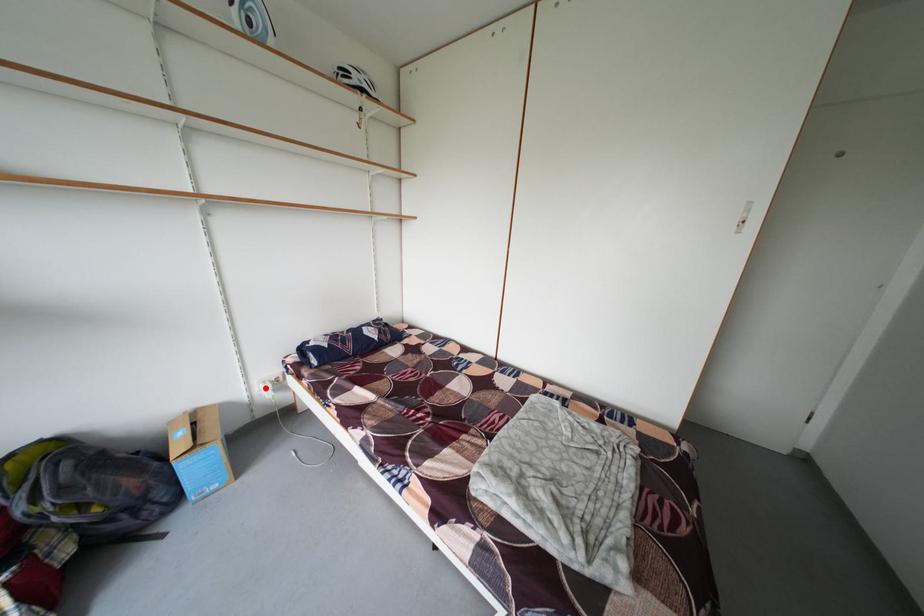
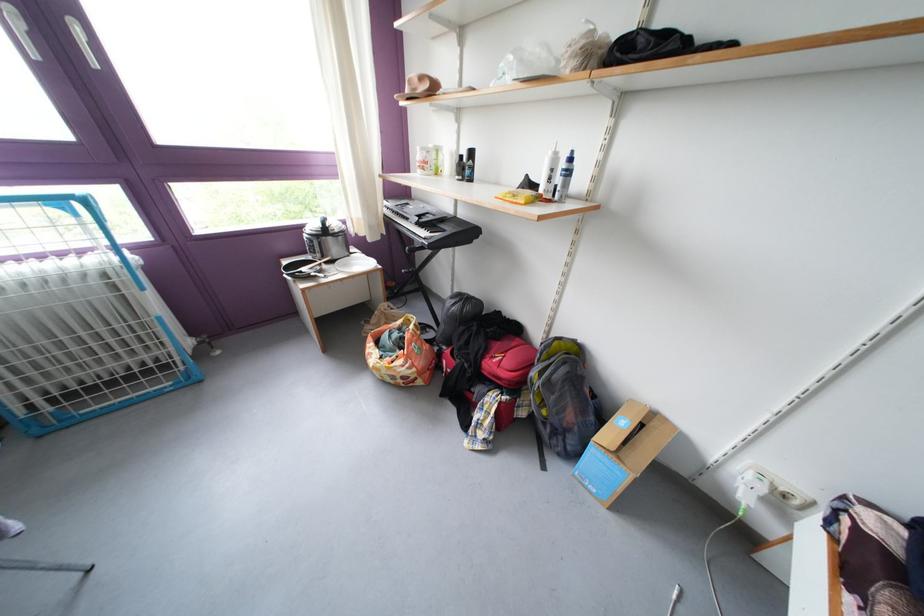
Locate, in the second image, the point that corresponds to the highlighted location in the first image.

(758, 467)